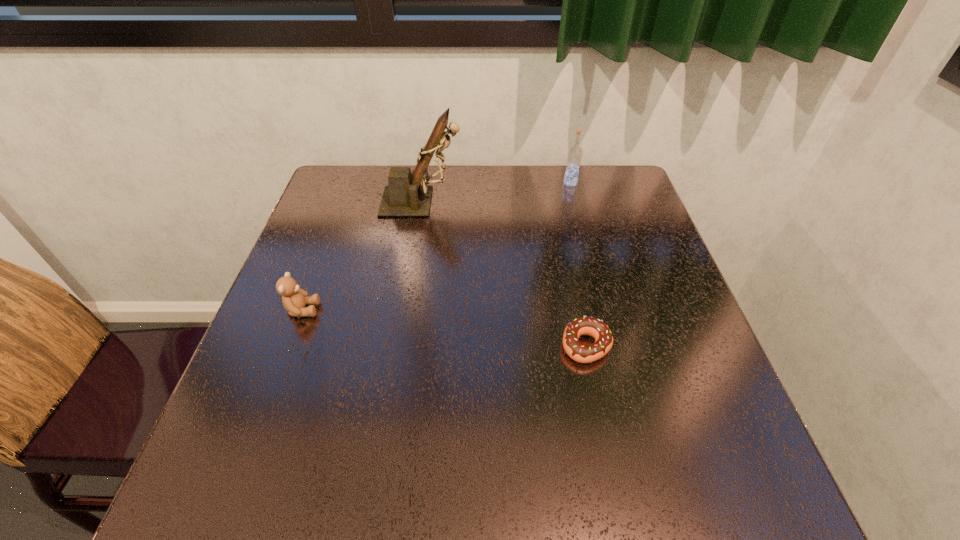
Identify the location of free point that satisfies the following two spatial constraints: 1. on the back side of the nearest object; 2. on the front-facing side of the figurine. The image size is (960, 540). (557, 202).

Image resolution: width=960 pixels, height=540 pixels. What are the coordinates of `free region that satisfies the following two spatial constraints: 1. on the front-facing side of the shortest object; 2. on the right side of the third object from right to left` in the screenshot? It's located at (399, 346).

Where is `vacant space that satisfies the following two spatial constraints: 1. on the front-facing side of the third farthest object; 2. on the right side of the shortest object`? This screenshot has height=540, width=960. vacant space that satisfies the following two spatial constraints: 1. on the front-facing side of the third farthest object; 2. on the right side of the shortest object is located at coordinates (289, 346).